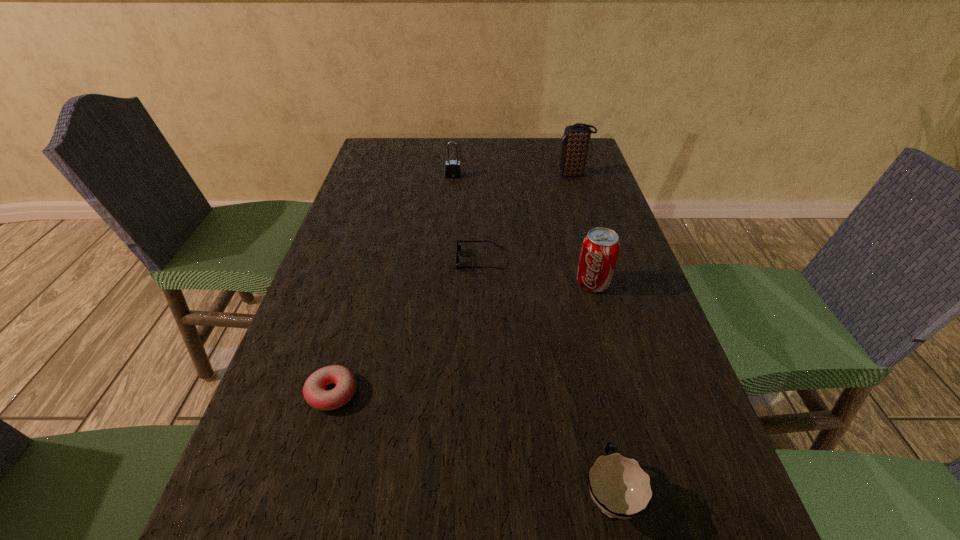
Where is `object that is at the far edge`? This screenshot has height=540, width=960. object that is at the far edge is located at coordinates (576, 138).

You are a GUI agent. You are given a task and a screenshot of the screen. Output one action in this format:
    pyautogui.click(x=<x>, y=<y>)
    Task: Click on the object that is positioned at the left edge
    The height and width of the screenshot is (540, 960).
    Given the screenshot: What is the action you would take?
    pyautogui.click(x=314, y=392)

Identify the location of clutch bag that is at the right edge. Image resolution: width=960 pixels, height=540 pixels. (576, 138).

The image size is (960, 540). In order to click on soda that is at the right edge in this screenshot , I will do [600, 249].

The width and height of the screenshot is (960, 540). I want to click on cup present at the right edge, so click(x=621, y=488).

The width and height of the screenshot is (960, 540). In order to click on object present at the far right corner in this screenshot , I will do `click(576, 138)`.

In the image, there is a desktop. Where is `vacant space at the far edge`? This screenshot has width=960, height=540. vacant space at the far edge is located at coordinates (416, 163).

This screenshot has height=540, width=960. In the image, there is a desktop. In order to click on free space at the left edge in this screenshot , I will do `click(346, 303)`.

Where is `free space at the right edge of the desktop`? The height and width of the screenshot is (540, 960). free space at the right edge of the desktop is located at coordinates (697, 487).

You are a GUI agent. You are given a task and a screenshot of the screen. Output one action in this format:
    pyautogui.click(x=<x>, y=<y>)
    Task: Click on the free space at the far left corner of the desktop
    This screenshot has width=960, height=540.
    Given the screenshot: What is the action you would take?
    pyautogui.click(x=362, y=164)